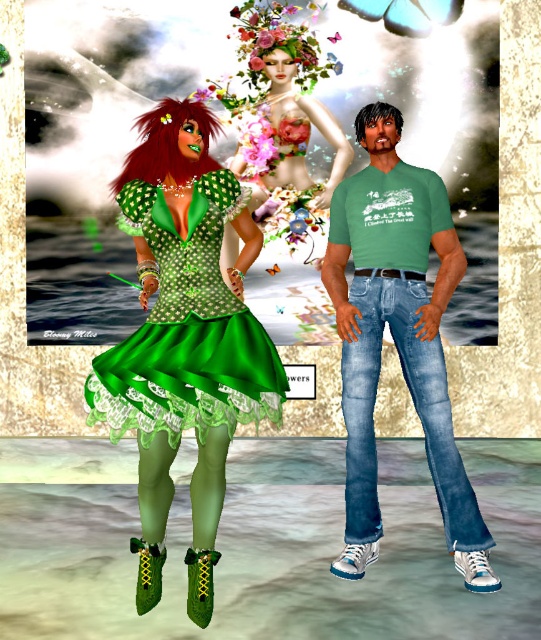
Which is below, green polka dot fabric dress at left or dark brown matte hair at upper center?

green polka dot fabric dress at left is below.

How distant is green polka dot fabric dress at left from dark brown matte hair at upper center?

green polka dot fabric dress at left is 5.51 feet from dark brown matte hair at upper center.

Is point (146, 220) positioned before point (377, 104)?

Yes, it is in front of point (377, 104).

At what (x,y) coordinates should I click in order to perform the action: click on green polka dot fabric dress at left. Please return your answer as a coordinate pair (x, y). Looking at the image, I should click on (187, 328).

Is green polka dot fabric dress at left to the left of shiny red hair at center from the viewer's perspective?

No, green polka dot fabric dress at left is not to the left of shiny red hair at center.

Which is more to the right, green polka dot fabric dress at left or shiny red hair at center?

green polka dot fabric dress at left is more to the right.

Which is in front, point (275, 422) or point (155, 164)?

Point (155, 164) is in front.

You are a GUI agent. You are given a task and a screenshot of the screen. Output one action in this format:
    pyautogui.click(x=<x>, y=<y>)
    Task: Click on the green polka dot fabric dress at left
    The image size is (541, 640).
    Given the screenshot: What is the action you would take?
    pyautogui.click(x=187, y=328)

Is point (352, 342) farther from camera compared to point (159, 129)?

That is True.

Which is below, blue denim jeans at center or shiny red hair at center?

blue denim jeans at center is below.

This screenshot has height=640, width=541. What are the coordinates of `blue denim jeans at center` in the screenshot? It's located at (413, 404).

At what (x,y) coordinates should I click in order to perform the action: click on blue denim jeans at center. Please return your answer as a coordinate pair (x, y). Looking at the image, I should click on (413, 404).